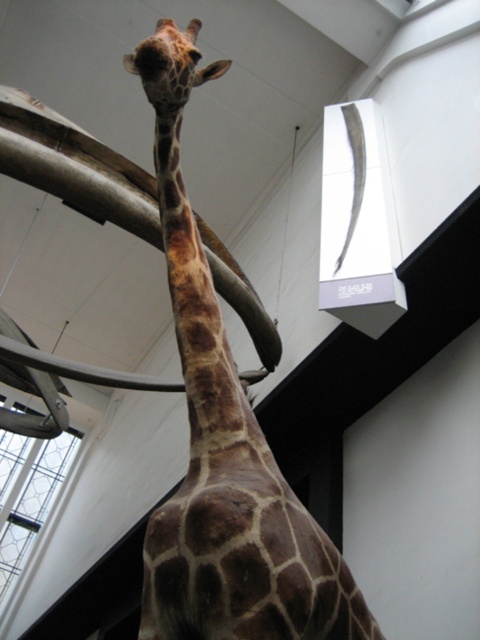
You are a photographer trying to capture the brown spotted giraffe at center and the brown textured neck at center in a single frame. Based on their widths, which one should you adjust your camera angle to focus on to ensure both fit in the photo?

The brown spotted giraffe at center is wider than the brown textured neck at center, so you should focus on the brown spotted giraffe at center to ensure both fit in the photo.

You are standing in front of a museum exhibit featuring a giraffe and a display case. You notice the brown spotted giraffe at center and the brown textured neck at center. Which object is closer to your right side?

The brown spotted giraffe at center is positioned on the right side of brown textured neck at center, so the brown spotted giraffe at center is closer to your right side.

You are standing in a museum and looking up at the matte gray beam at upper center. If you want to touch it without any equipment, would you be able to reach it?

The matte gray beam at upper center is 5.45 meters away from the camera, so it is too far to reach without equipment.